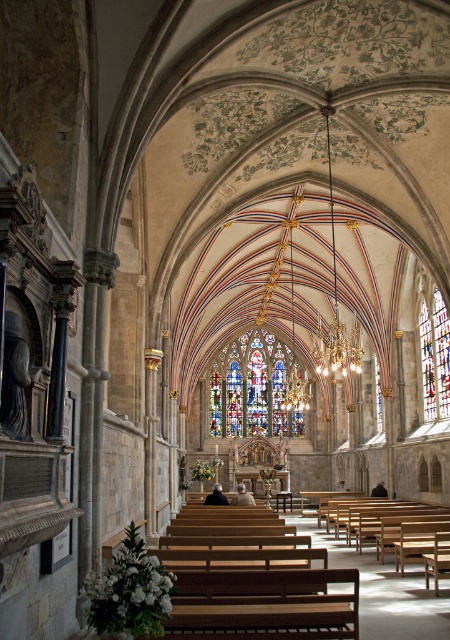
Who is more distant from viewer, (287, 353) or (424, 344)?

The point (287, 353) is behind.

Between stained glass at center and multicolored stained glass at right, which one appears on the left side from the viewer's perspective?

stained glass at center

This screenshot has width=450, height=640. Identify the location of stained glass at center. (255, 388).

I want to click on stained glass at center, so click(255, 388).